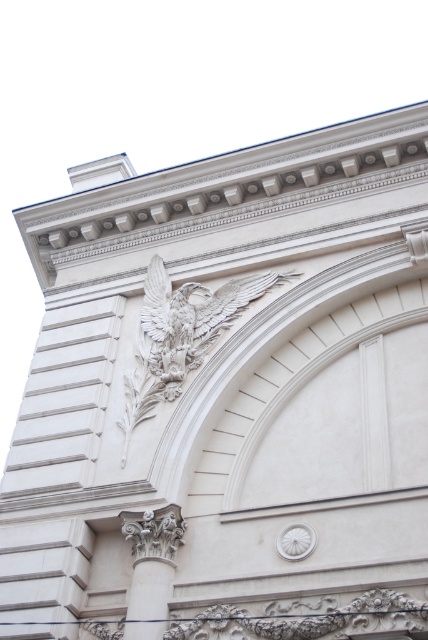
Does white stone eagle at upper center have a smaller size compared to white stone column at center?

Incorrect, white stone eagle at upper center is not smaller in size than white stone column at center.

Between white stone eagle at upper center and white stone column at center, which one appears on the left side from the viewer's perspective?

white stone column at center is more to the left.

Is point (145, 394) farther from viewer compared to point (133, 550)?

Yes, point (145, 394) is farther from viewer.

Find the location of a particular element. white stone eagle at upper center is located at coordinates (181, 333).